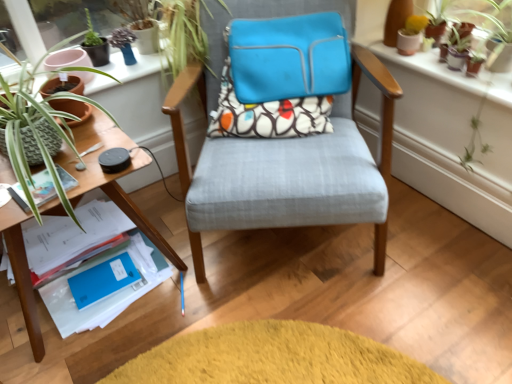
Find the location of a particular element. The height and width of the screenshot is (384, 512). vacant area that is situated to the right of blue matte paper at lower left, the first paperback book from the back is located at coordinates (147, 266).